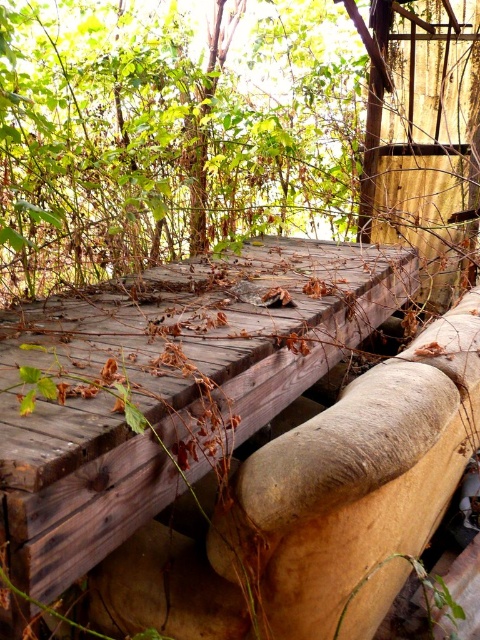
Question: Among these objects, which one is farthest from the camera?

Choices:
 (A) green leafy tree at upper center
 (B) weathered wood bench at center

Answer: (A)

Question: Which point is farther to the camera?

Choices:
 (A) (184, 467)
 (B) (86, 198)

Answer: (B)

Question: Considering the relative positions of green leafy tree at upper center and weathered wood bench at center in the image provided, where is green leafy tree at upper center located with respect to weathered wood bench at center?

Choices:
 (A) right
 (B) left

Answer: (B)

Question: Can you confirm if green leafy tree at upper center is positioned above weathered wood bench at center?

Choices:
 (A) no
 (B) yes

Answer: (B)

Question: Can you confirm if green leafy tree at upper center is wider than weathered wood bench at center?

Choices:
 (A) yes
 (B) no

Answer: (A)